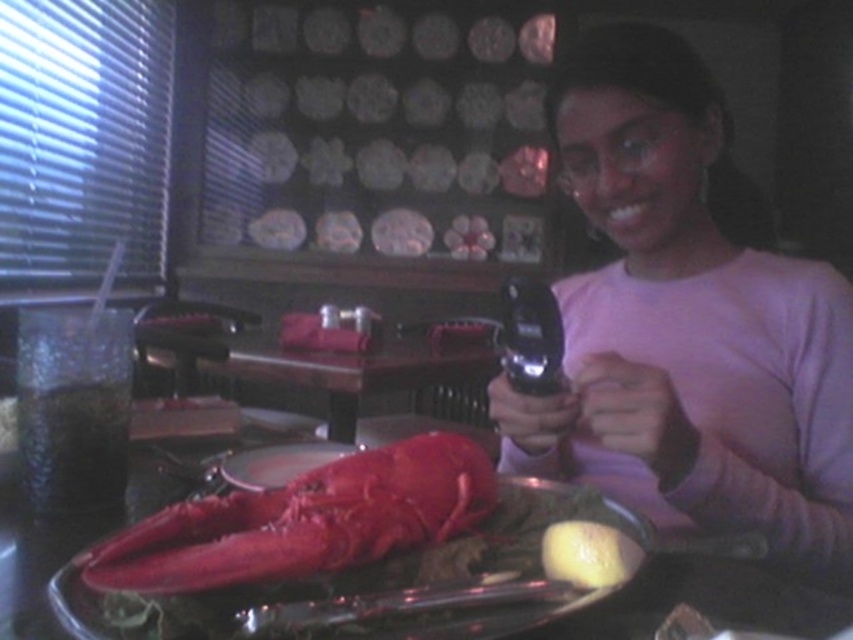
Can you confirm if shiny red lobster at center is positioned to the right of yellow matte lemon at lower center?

In fact, shiny red lobster at center is to the left of yellow matte lemon at lower center.

Who is taller, shiny red lobster at center or yellow matte lemon at lower center?

Standing taller between the two is shiny red lobster at center.

Locate an element on the screen. This screenshot has height=640, width=853. shiny red lobster at center is located at coordinates (305, 520).

Does shiny red lobster at center appear under shiny metal tray at center?

No.

Looking at this image, which of these two, shiny red lobster at center or shiny metal tray at center, stands shorter?

With less height is shiny metal tray at center.

Which is behind, point (222, 556) or point (181, 417)?

Positioned behind is point (181, 417).

Find the location of a particular element. The image size is (853, 640). shiny red lobster at center is located at coordinates (305, 520).

Which is more to the left, pink matte phone at upper right or shiny red lobster at center?

From the viewer's perspective, shiny red lobster at center appears more on the left side.

Between pink matte phone at upper right and shiny red lobster at center, which one has less height?

shiny red lobster at center is shorter.

Is point (587, 88) farther from camera compared to point (316, 531)?

Yes, point (587, 88) is behind point (316, 531).

The height and width of the screenshot is (640, 853). What are the coordinates of `pink matte phone at upper right` in the screenshot? It's located at (688, 321).